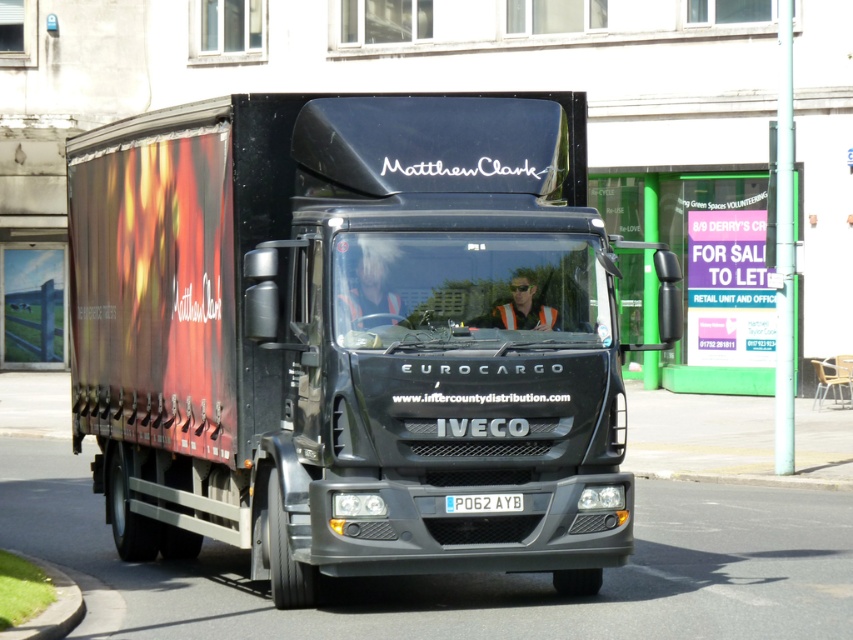
Does matte black truck at center have a lesser height compared to blue metallic license plate at center?

In fact, matte black truck at center may be taller than blue metallic license plate at center.

Which is more to the right, matte black truck at center or blue metallic license plate at center?

From the viewer's perspective, blue metallic license plate at center appears more on the right side.

Does point (297, 355) lie behind point (460, 513)?

Yes, point (297, 355) is farther from viewer.

Where is `matte black truck at center`? This screenshot has width=853, height=640. matte black truck at center is located at coordinates (352, 333).